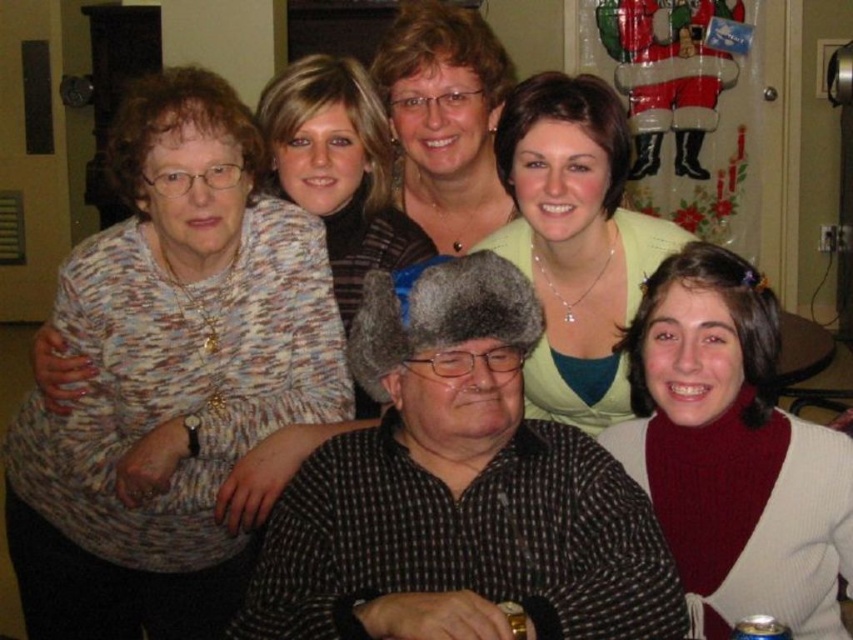
In the scene shown: You are a photographer trying to capture a clear shot of both the checkered fabric shirt at center and the light green fabric shirt at center. Which one is closer to the camera?

The checkered fabric shirt at center is positioned under the light green fabric shirt at center, so the light green fabric shirt at center is closer to the camera.

You are a photographer setting up for a group photo. You notice two sweaters in the scene, the knitted red sweater at lower right and the matte black sweater at upper center. Which sweater is positioned lower in the image?

The knitted red sweater at lower right is positioned lower in the image than the matte black sweater at upper center.

You are standing in front of the group photo and want to determine the relative positions of two specific points marked in the image. The first point is at coordinate point [117,282] and the second is at point [390,48]. Which of these two points is nearer to your current position?

Point [117,282] is closer to the camera than point [390,48], so the first point is nearer to your current position.